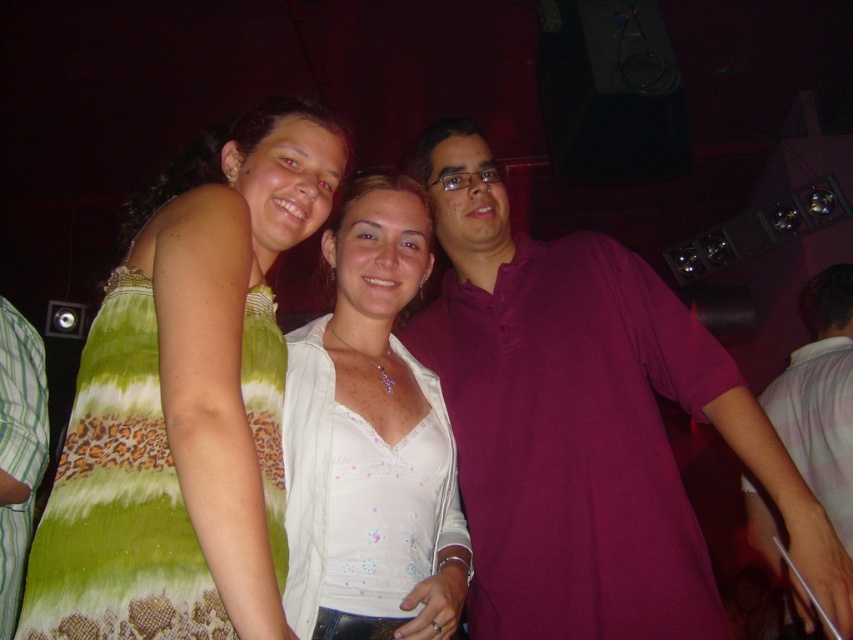
Who is more forward, (270, 371) or (16, 573)?

Point (270, 371) is more forward.

Is point (219, 145) positioned before point (28, 432)?

Yes, it is in front of point (28, 432).

Identify the location of green tie-dye dress at center. (186, 397).

Between green tie-dye dress at center and purple cotton shirt at right, which one appears on the left side from the viewer's perspective?

Positioned to the left is green tie-dye dress at center.

Is point (276, 612) closer to viewer compared to point (833, 397)?

Yes, point (276, 612) is closer to viewer.

This screenshot has height=640, width=853. Identify the location of green tie-dye dress at center. (186, 397).

Can you confirm if white lace top at center is smaller than purple cotton shirt at right?

Yes, white lace top at center is smaller than purple cotton shirt at right.

Who is lower down, white lace top at center or purple cotton shirt at right?

purple cotton shirt at right is below.

Who is more distant from viewer, (306, 474) or (848, 518)?

Positioned behind is point (848, 518).

Find the location of a particular element. The width and height of the screenshot is (853, 640). white lace top at center is located at coordinates (370, 428).